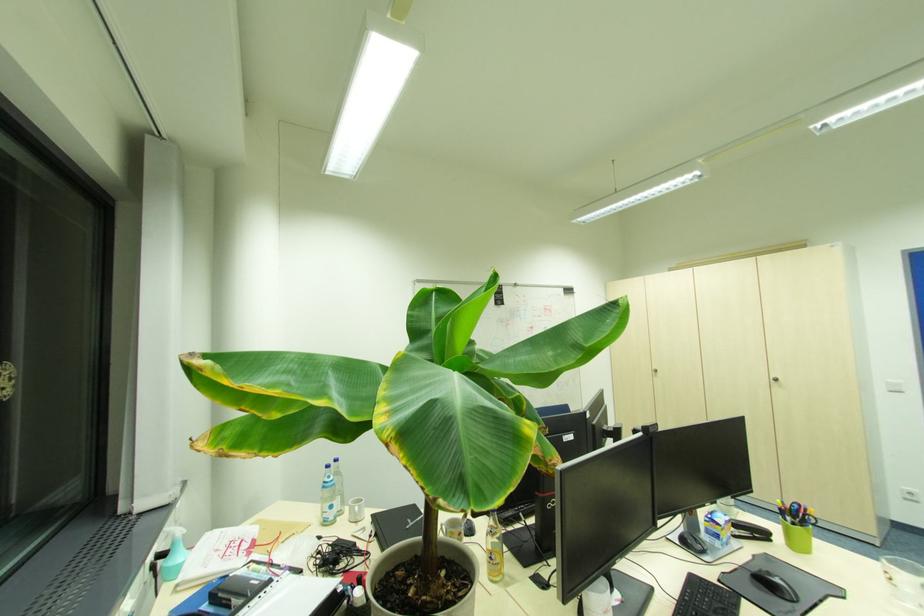
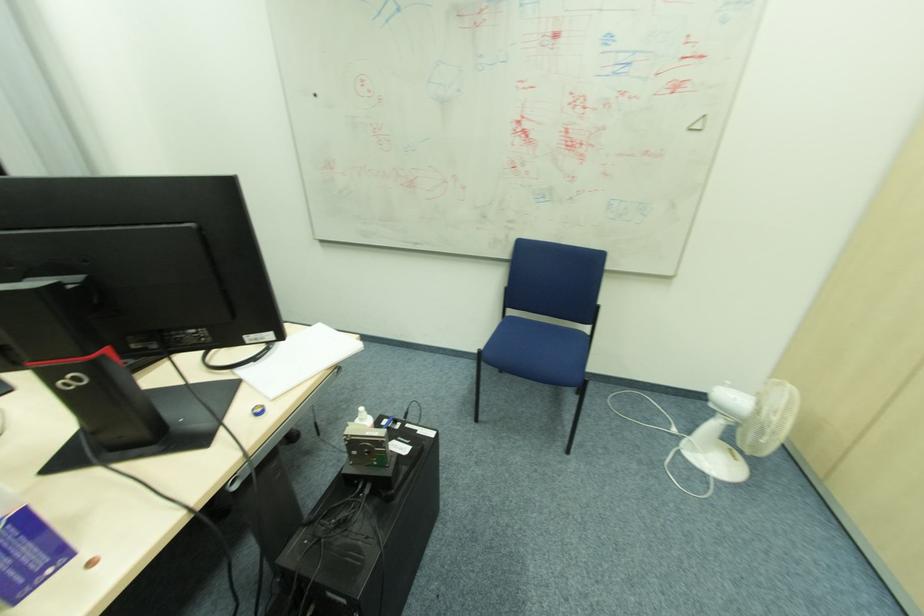
Question: I am providing you with two images of the same scene from different viewpoints. Please identify which objects are invisible in image2.

Choices:
 (A) fuse box latch
 (B) white mug
 (C) white pump bottle
 (D) chair sitting surface

Answer: (B)